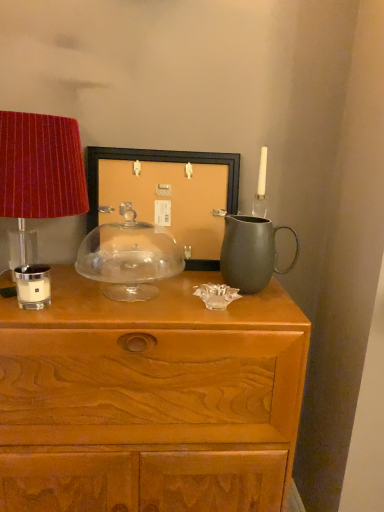
Identify the location of free space in front of matte gray jug at right. (258, 311).